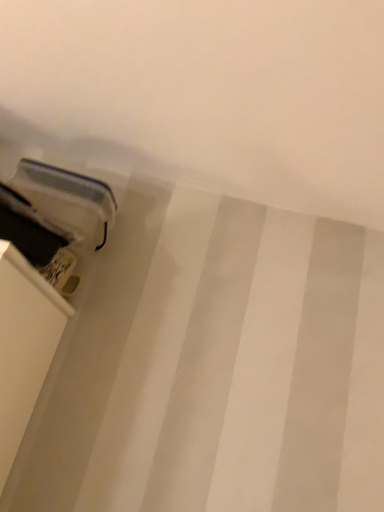
The width and height of the screenshot is (384, 512). Identify the location of matte plastic shelf at lower left. (34, 277).

What do you see at coordinates (34, 277) in the screenshot?
I see `matte plastic shelf at lower left` at bounding box center [34, 277].

At what (x,y) coordinates should I click in order to perform the action: click on matte plastic container at lower left. Please return your answer as a coordinate pair (x, y). This screenshot has width=384, height=512. Looking at the image, I should click on (55, 209).

This screenshot has width=384, height=512. Describe the element at coordinates (55, 209) in the screenshot. I see `matte plastic container at lower left` at that location.

At what (x,y) coordinates should I click in order to perform the action: click on matte plastic shelf at lower left. Please return your answer as a coordinate pair (x, y). This screenshot has width=384, height=512. Looking at the image, I should click on (34, 277).

Between matte plastic shelf at lower left and matte plastic container at lower left, which one appears on the right side from the viewer's perspective?

matte plastic container at lower left is more to the right.

Is the depth of matte plastic shelf at lower left greater than that of matte plastic container at lower left?

No, matte plastic shelf at lower left is closer to the camera.

Is point (52, 290) closer or farther from the camera than point (18, 186)?

Clearly, point (52, 290) is closer to the camera than point (18, 186).

From the image's perspective, is matte plastic shelf at lower left located above matte plastic container at lower left?

Actually, matte plastic shelf at lower left appears below matte plastic container at lower left in the image.

From a real-world perspective, which object rests below the other?

matte plastic shelf at lower left.

From the picture: Can you confirm if matte plastic shelf at lower left is wider than matte plastic container at lower left?

No, matte plastic shelf at lower left is not wider than matte plastic container at lower left.

Can you confirm if matte plastic shelf at lower left is shorter than matte plastic container at lower left?

Correct, matte plastic shelf at lower left is not as tall as matte plastic container at lower left.

Is matte plastic shelf at lower left smaller than matte plastic container at lower left?

Indeed, matte plastic shelf at lower left has a smaller size compared to matte plastic container at lower left.

Do you think matte plastic shelf at lower left is within matte plastic container at lower left, or outside of it?

matte plastic shelf at lower left is not enclosed by matte plastic container at lower left.

Is matte plastic shelf at lower left directly adjacent to matte plastic container at lower left?

No, matte plastic shelf at lower left is not next to matte plastic container at lower left.

Is matte plastic shelf at lower left oriented towards matte plastic container at lower left?

No, matte plastic shelf at lower left is not turned towards matte plastic container at lower left.

Can you tell me how much matte plastic shelf at lower left and matte plastic container at lower left differ in facing direction?

The angular difference between matte plastic shelf at lower left and matte plastic container at lower left is 0.000451 degrees.

Measure the distance from matte plastic shelf at lower left to matte plastic container at lower left.

matte plastic shelf at lower left is 6.15 inches from matte plastic container at lower left.

Where is `equipment that is above the matte plastic shelf at lower left (from a real-world perspective)`? equipment that is above the matte plastic shelf at lower left (from a real-world perspective) is located at coordinates (55, 209).

Which is more to the left, matte plastic container at lower left or matte plastic shelf at lower left?

Positioned to the left is matte plastic shelf at lower left.

Is matte plastic container at lower left positioned before matte plastic shelf at lower left?

No, matte plastic container at lower left is further to the viewer.

Which is less distant, (x=21, y=227) or (x=45, y=284)?

Positioned in front is point (x=21, y=227).

From the image's perspective, which object appears higher, matte plastic container at lower left or matte plastic shelf at lower left?

matte plastic container at lower left is shown above in the image.

From a real-world perspective, is matte plastic container at lower left positioned above or below matte plastic shelf at lower left?

From a real-world perspective, matte plastic container at lower left is physically above matte plastic shelf at lower left.

Considering the relative sizes of matte plastic container at lower left and matte plastic shelf at lower left in the image provided, is matte plastic container at lower left wider than matte plastic shelf at lower left?

Correct, the width of matte plastic container at lower left exceeds that of matte plastic shelf at lower left.

Who is taller, matte plastic container at lower left or matte plastic shelf at lower left?

matte plastic container at lower left.

Looking at this image, based on their sizes in the image, would you say matte plastic container at lower left is bigger or smaller than matte plastic shelf at lower left?

In the image, matte plastic container at lower left appears to be larger than matte plastic shelf at lower left.

Would you say matte plastic container at lower left is inside or outside matte plastic shelf at lower left?

matte plastic container at lower left exists outside the volume of matte plastic shelf at lower left.

Is matte plastic container at lower left next to matte plastic shelf at lower left and touching it?

No, matte plastic container at lower left is not beside matte plastic shelf at lower left.

Is matte plastic container at lower left positioned with its back to matte plastic shelf at lower left?

matte plastic container at lower left is not turned away from matte plastic shelf at lower left.

How different are the orientations of matte plastic container at lower left and matte plastic shelf at lower left in degrees?

The angle between the facing direction of matte plastic container at lower left and the facing direction of matte plastic shelf at lower left is 0.000451 degrees.

How much distance is there between matte plastic container at lower left and matte plastic shelf at lower left?

matte plastic container at lower left is 6.15 inches away from matte plastic shelf at lower left.

The width and height of the screenshot is (384, 512). Find the location of `shelf located in front of the matte plastic container at lower left`. shelf located in front of the matte plastic container at lower left is located at coordinates coord(34,277).

Where is `equipment that is above the matte plastic shelf at lower left (from a real-world perspective)`? The height and width of the screenshot is (512, 384). equipment that is above the matte plastic shelf at lower left (from a real-world perspective) is located at coordinates (55, 209).

The image size is (384, 512). Identify the location of equipment lying on the right of matte plastic shelf at lower left. (55, 209).